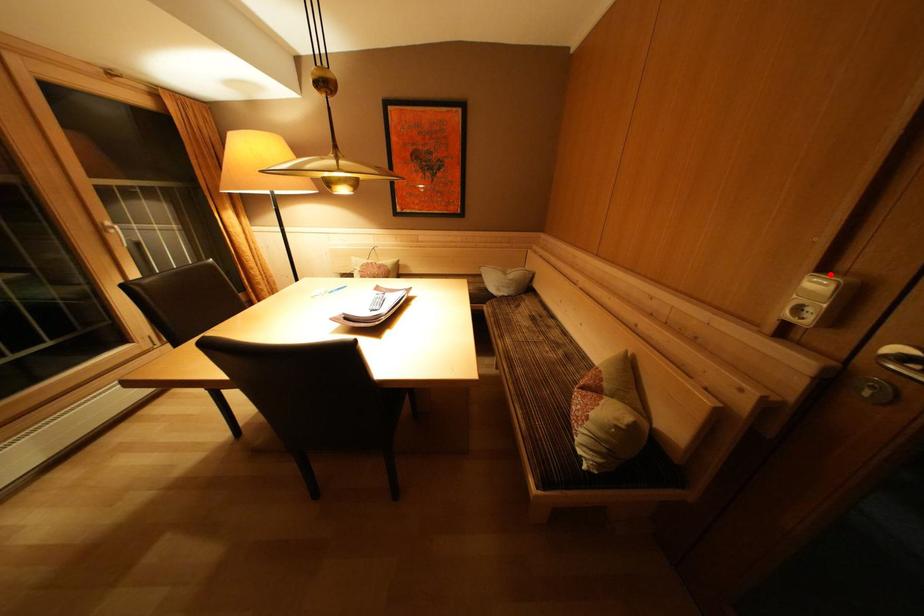
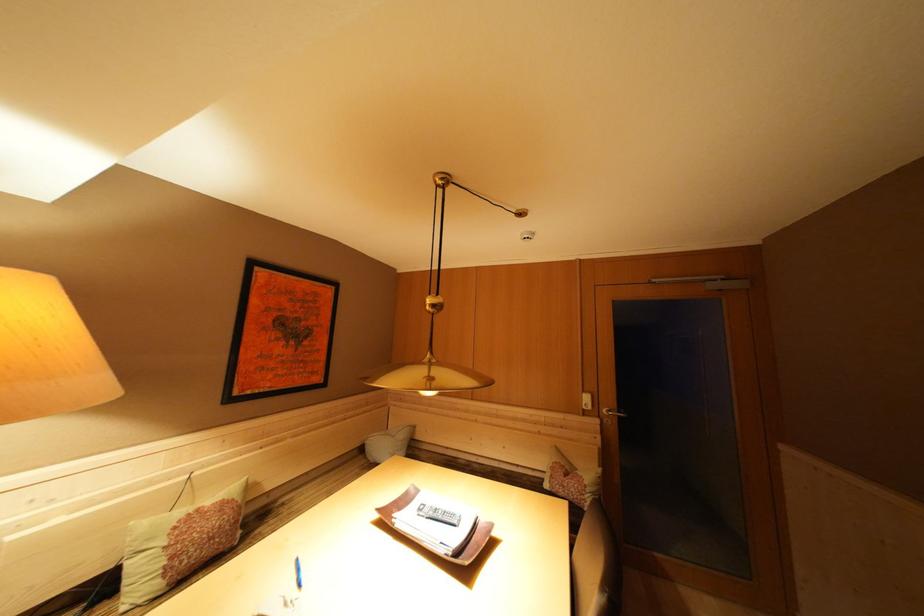
The point at the highlighted location is marked in the first image. Where is the corresponding point in the second image?

(590, 397)